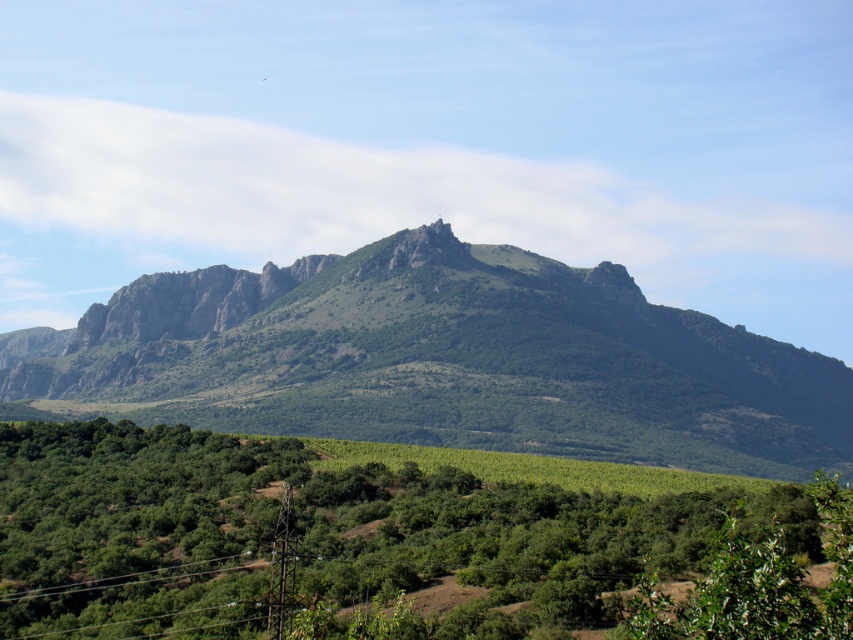
Can you confirm if green leafy tree at center is positioned to the right of green textured mountain at center?

Correct, you'll find green leafy tree at center to the right of green textured mountain at center.

Which is behind, point (416, 609) or point (769, 468)?

The point (769, 468) is more distant.

Where is `green leafy tree at center`? green leafy tree at center is located at coordinates [386, 547].